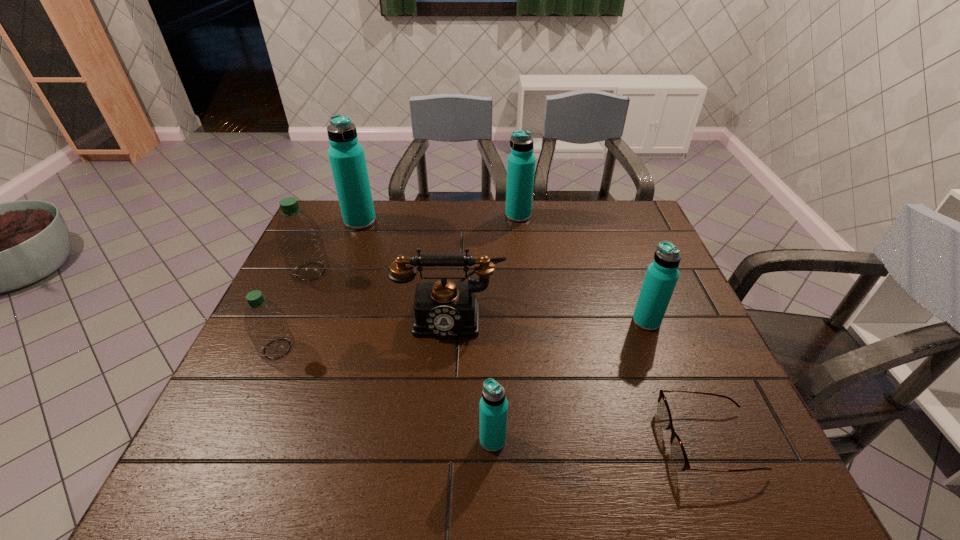
Where is `free region at the far edge of the desktop`? The width and height of the screenshot is (960, 540). free region at the far edge of the desktop is located at coordinates (403, 202).

Find the location of a particular element. This screenshot has width=960, height=540. vacant space at the near edge of the desktop is located at coordinates (588, 454).

Where is `vacant space at the left edge of the desktop`? This screenshot has height=540, width=960. vacant space at the left edge of the desktop is located at coordinates (219, 436).

Locate an element on the screen. The height and width of the screenshot is (540, 960). vacant space at the right edge of the desktop is located at coordinates (635, 247).

At what (x,y) coordinates should I click in order to perform the action: click on vacant area at the far left corner of the desktop. Please return your answer as a coordinate pair (x, y). This screenshot has height=540, width=960. Looking at the image, I should click on (320, 209).

I want to click on vacant area at the far right corner of the desktop, so click(643, 215).

You are a GUI agent. You are given a task and a screenshot of the screen. Output one action in this format:
    pyautogui.click(x=<x>, y=<y>)
    Task: Click on the vacant area that lies between the nearer green water bottle and the farther green water bottle
    This screenshot has width=960, height=540.
    Given the screenshot: What is the action you would take?
    pyautogui.click(x=294, y=310)

I want to click on unoccupied area between the biggest blue water bottle and the shortest object, so click(x=535, y=331).

Find the location of a particular element. This screenshot has height=540, width=960. vacant region between the gray telephone and the rightmost water bottle is located at coordinates (548, 318).

The width and height of the screenshot is (960, 540). Identify the location of free area in between the farther green water bottle and the telephone. (380, 294).